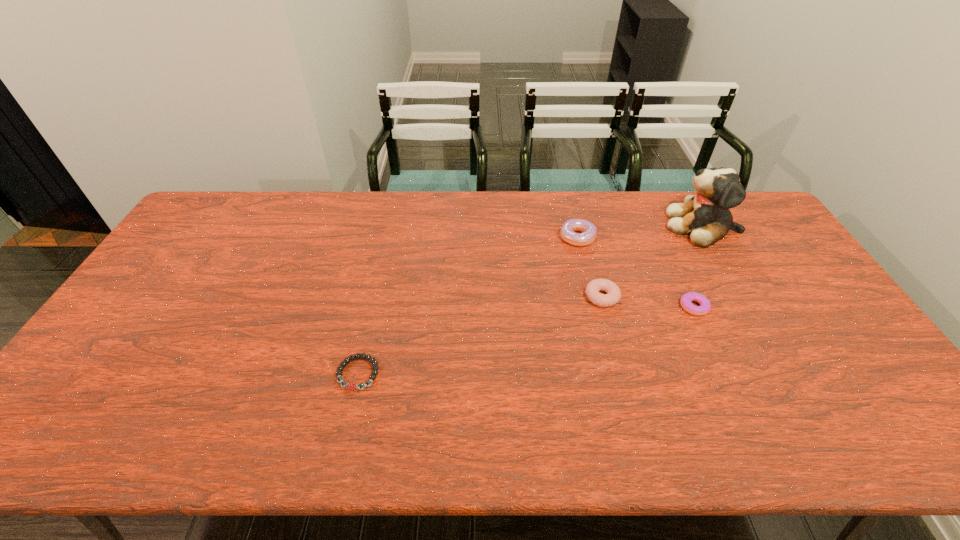
Locate an element on the screen. This screenshot has width=960, height=540. unoccupied area between the second shortest object and the tallest object is located at coordinates (698, 266).

Locate an element on the screen. The height and width of the screenshot is (540, 960). free space between the second shortest doughnut and the leftmost object is located at coordinates (480, 335).

This screenshot has height=540, width=960. Identify the location of free spot between the leftmost object and the tallest object. (530, 300).

Image resolution: width=960 pixels, height=540 pixels. I want to click on the fourth closest object relative to the shortest doughnut, so click(351, 385).

Locate an element on the screen. The height and width of the screenshot is (540, 960). object that is the closest to the second shortest doughnut is located at coordinates (588, 229).

Locate an element on the screen. The image size is (960, 540). doughnut that is the third closest one to the bracelet is located at coordinates (705, 306).

Locate an element on the screen. The width and height of the screenshot is (960, 540). doughnut that is the second closest to the second shortest doughnut is located at coordinates (705, 306).